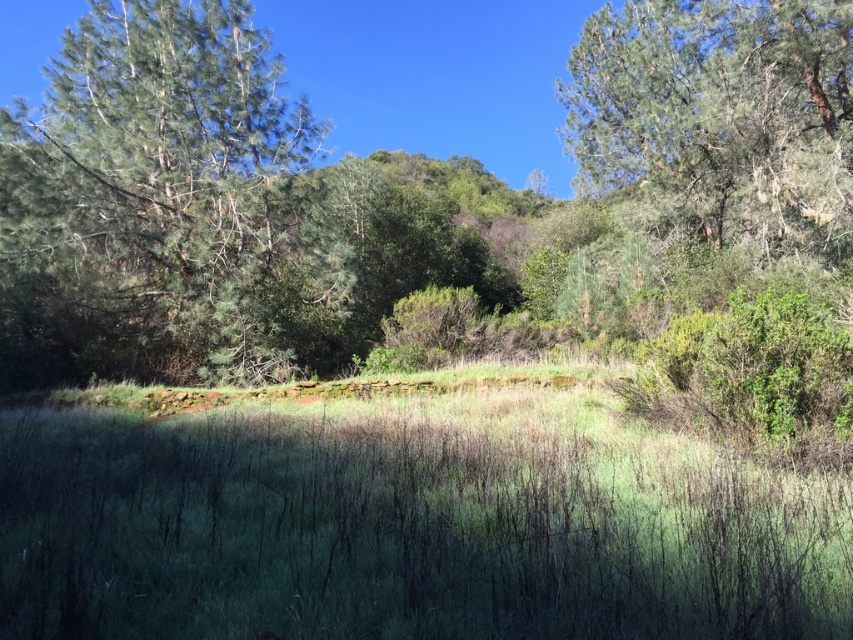
You are standing at the center of the grassy area and want to walk towards the green textured tree at left. Which direction should you head in?

The green textured tree at left is located at point 0.306 on the x and 0.174 on the y coordinate, so you should head towards the left to reach it.

Based on the photo, you are standing in the middle of the green grassy at center and want to walk towards the green textured tree at left. Which direction should you move to get closer to the tree?

Since the green grassy at center is in front of the green textured tree at left, you are already closer to the tree. To move towards it, you should walk forward in the direction of the tree.